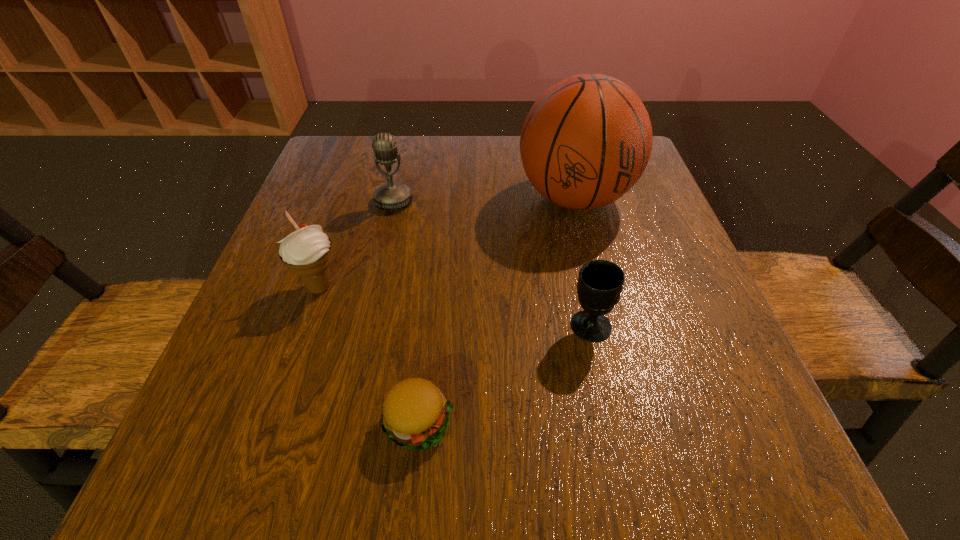
This screenshot has width=960, height=540. In order to click on vacant area situated on the front of the icecream in this screenshot , I will do `click(291, 370)`.

The height and width of the screenshot is (540, 960). Identify the location of vacant space located on the back of the chalice. (578, 272).

Locate an element on the screen. This screenshot has width=960, height=540. free spot located on the right of the hamburger is located at coordinates (526, 422).

Where is `basketball situated at the far edge`? This screenshot has width=960, height=540. basketball situated at the far edge is located at coordinates (586, 141).

The height and width of the screenshot is (540, 960). Find the location of `microphone located in the far edge section of the desktop`. microphone located in the far edge section of the desktop is located at coordinates (392, 195).

What are the coordinates of `object situated at the near edge` in the screenshot? It's located at (415, 415).

The width and height of the screenshot is (960, 540). Identify the location of microphone situated at the left edge. (392, 195).

Locate an element on the screen. icecream that is positioned at the left edge is located at coordinates (307, 252).

Locate an element on the screen. The width and height of the screenshot is (960, 540). object positioned at the right edge is located at coordinates (586, 141).

Where is `object that is positioned at the far left corner`? object that is positioned at the far left corner is located at coordinates (392, 195).